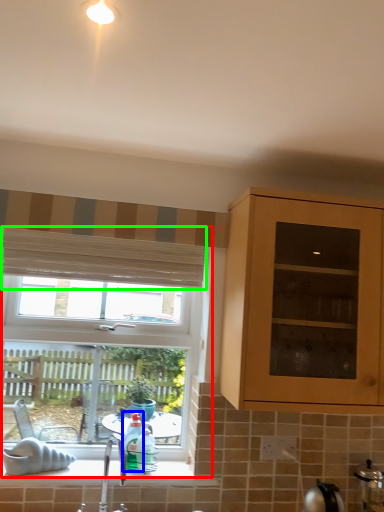
Question: Estimate the real-world distances between objects in this image. Which object is farther from window (highlighted by a red box), bottle (highlighted by a blue box) or curtain (highlighted by a green box)?

Choices:
 (A) bottle
 (B) curtain

Answer: (A)